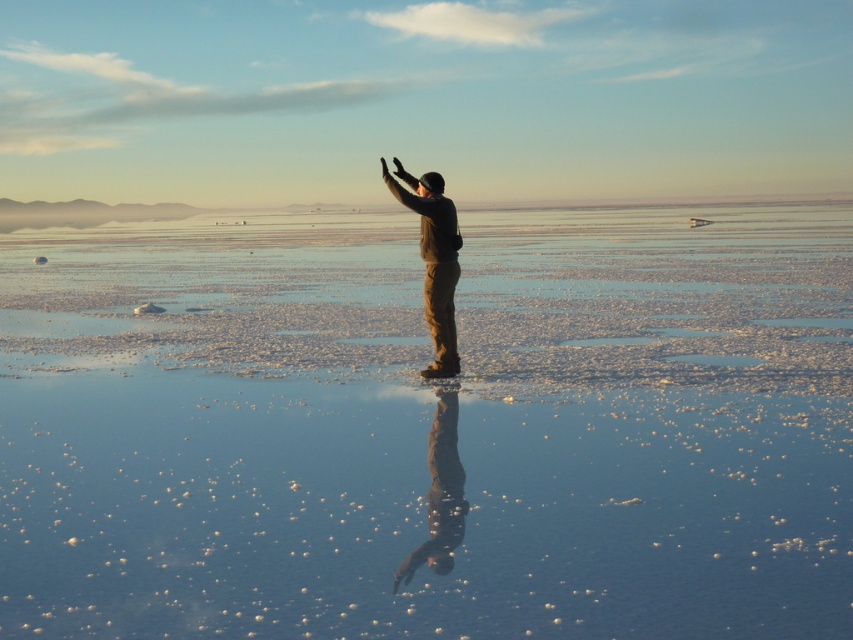
Which is in front, point (682, 422) or point (445, 356)?

Point (682, 422) is in front.

Who is more distant from viewer, [730,346] or [450,364]?

Point [730,346]

I want to click on clear glass water at center, so click(428, 426).